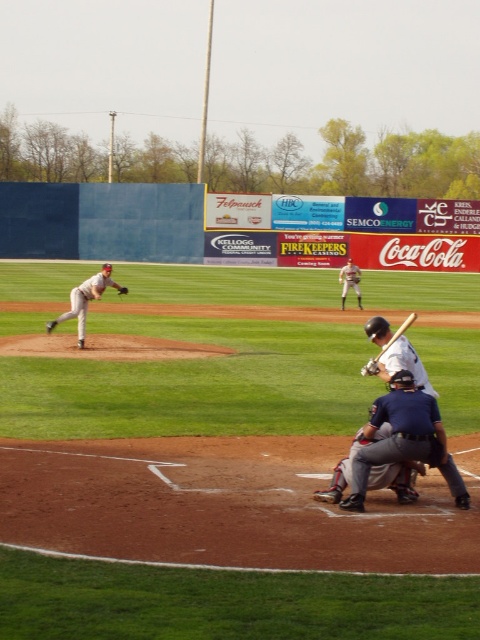
Question: Does gray fabric catcher at lower center come in front of wooden bat at lower center?

Choices:
 (A) yes
 (B) no

Answer: (A)

Question: Can you confirm if gray fabric catcher at lower center is wider than brown leather glove at center?

Choices:
 (A) yes
 (B) no

Answer: (B)

Question: Which is farther from the brown leather glove at center?

Choices:
 (A) dark blue uniform at lower center
 (B) white uniform baseball player at center
 (C) gray fabric catcher at lower center
 (D) gray uniformed pitcher at left

Answer: (A)

Question: Which object is farther from the camera taking this photo?

Choices:
 (A) gray fabric catcher at lower center
 (B) white uniform baseball player at center

Answer: (B)

Question: Can you confirm if dark blue uniform at lower center is thinner than gray uniformed pitcher at left?

Choices:
 (A) yes
 (B) no

Answer: (A)

Question: Which point is farther to the camera?

Choices:
 (A) gray fabric catcher at lower center
 (B) white uniform baseball player at center

Answer: (B)